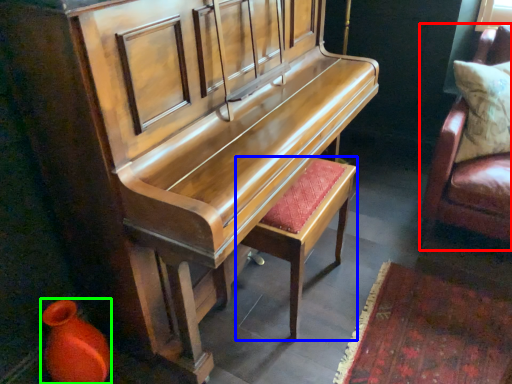
Question: Considering the real-world distances, which object is farthest from furniture (highlighted by a red box)? stool (highlighted by a blue box) or vase (highlighted by a green box)?

Choices:
 (A) stool
 (B) vase

Answer: (B)